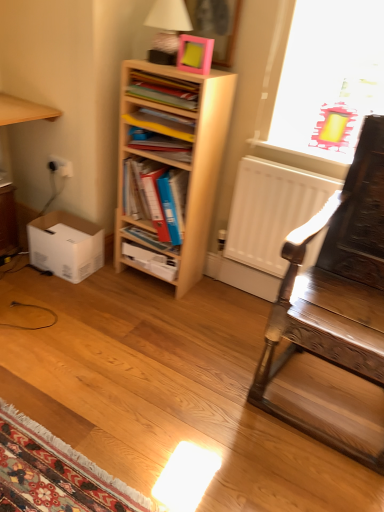
The width and height of the screenshot is (384, 512). In order to click on free region on the left part of dark brown polished wood chair at right in this screenshot , I will do `click(200, 379)`.